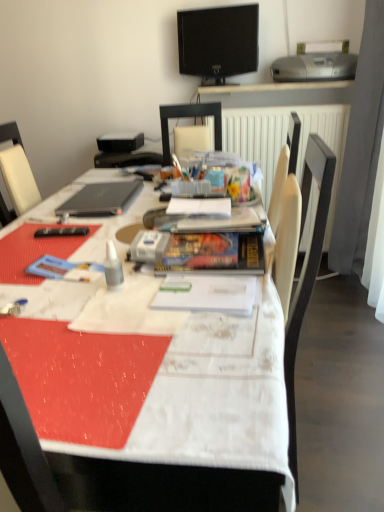
Question: From the image's perspective, is matte black chair at center positioned above or below sleek black laptop at upper left?

Choices:
 (A) below
 (B) above

Answer: (B)

Question: Is matte black chair at center wider or thinner than sleek black laptop at upper left?

Choices:
 (A) thin
 (B) wide

Answer: (B)

Question: Which of these objects is positioned farthest from the silver metallic printer at upper right?

Choices:
 (A) hardcover book at center, marked as the 1th paperback book in a back-to-front arrangement
 (B) matte black chair at center
 (C) white textured tablecloth at center
 (D) sleek black laptop at upper left
 (E) clear plastic bottle at center

Answer: (E)

Question: Which object is positioned closest to the black glossy tv at upper center?

Choices:
 (A) white textured tablecloth at center
 (B) sleek black laptop at upper left
 (C) matte black chair at center
 (D) clear plastic bottle at center
 (E) hardcover book at center, the 1th paperback book in the top-to-bottom sequence

Answer: (C)